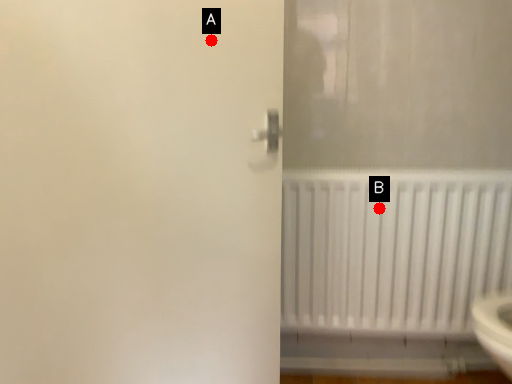
Question: Two points are circled on the image, labeled by A and B beside each circle. Among these points, which one is nearest to the camera?

Choices:
 (A) A is closer
 (B) B is closer

Answer: (A)